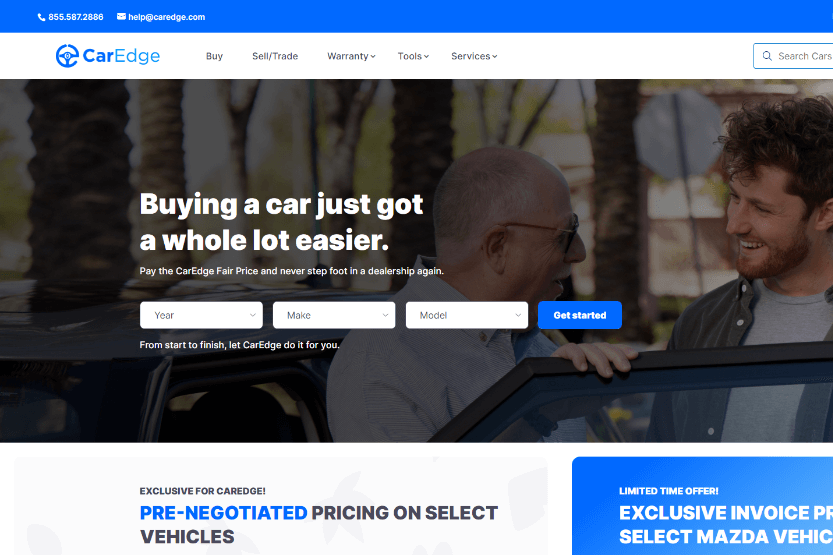
Where is `box`? box is located at coordinates (599, 476).